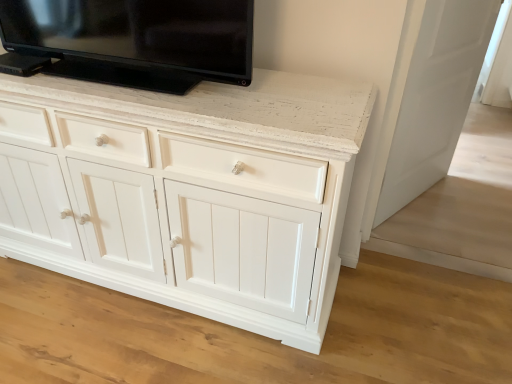
Question: From the image's perspective, is black glossy tv at upper center located above or below white glossy door at right?

Choices:
 (A) below
 (B) above

Answer: (B)

Question: From a real-world perspective, is black glossy tv at upper center above or below white glossy door at right?

Choices:
 (A) above
 (B) below

Answer: (A)

Question: Would you say black glossy tv at upper center is inside or outside white glossy door at right?

Choices:
 (A) inside
 (B) outside

Answer: (B)

Question: From their relative heights in the image, would you say white glossy door at right is taller or shorter than black glossy tv at upper center?

Choices:
 (A) tall
 (B) short

Answer: (A)

Question: Considering the positions of point (408, 188) and point (233, 28), is point (408, 188) closer or farther from the camera than point (233, 28)?

Choices:
 (A) closer
 (B) farther

Answer: (B)

Question: Looking at their shapes, would you say white glossy door at right is wider or thinner than black glossy tv at upper center?

Choices:
 (A) wide
 (B) thin

Answer: (B)

Question: From the image's perspective, is white glossy door at right above or below black glossy tv at upper center?

Choices:
 (A) below
 (B) above

Answer: (A)